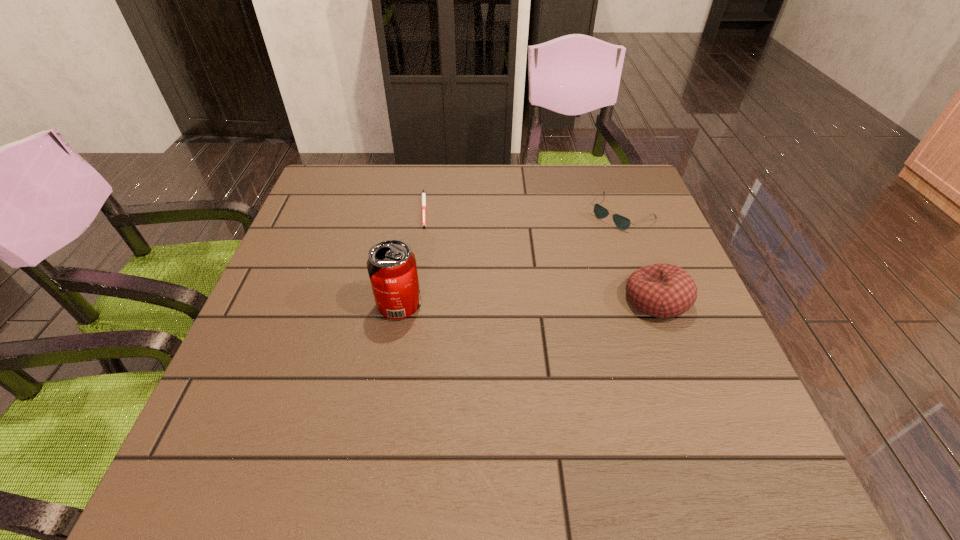
At what (x,y) coordinates should I click in order to perform the action: click on free location located on the clicker of the shortest object. Please return your answer as a coordinate pair (x, y). This screenshot has width=960, height=540. Looking at the image, I should click on (442, 241).

Image resolution: width=960 pixels, height=540 pixels. I want to click on blank space located 0.180m on the clicker of the shortest object, so click(x=465, y=262).

Image resolution: width=960 pixels, height=540 pixels. I want to click on sunglasses positioned at the far edge, so click(x=623, y=223).

The width and height of the screenshot is (960, 540). Identify the location of pen positioned at the far edge. (423, 193).

Locate an element on the screen. The width and height of the screenshot is (960, 540). beanbag that is positioned at the right edge is located at coordinates (660, 290).

Image resolution: width=960 pixels, height=540 pixels. In order to click on sunglasses positioned at the right edge in this screenshot , I will do `click(623, 223)`.

Where is `object that is at the far right corner`? Image resolution: width=960 pixels, height=540 pixels. object that is at the far right corner is located at coordinates (623, 223).

Locate an element on the screen. The width and height of the screenshot is (960, 540). vacant region at the far edge of the desktop is located at coordinates (468, 209).

Where is `blank area at the near edge`? Image resolution: width=960 pixels, height=540 pixels. blank area at the near edge is located at coordinates pyautogui.click(x=315, y=395).

The image size is (960, 540). I want to click on free space at the left edge of the desktop, so click(247, 358).